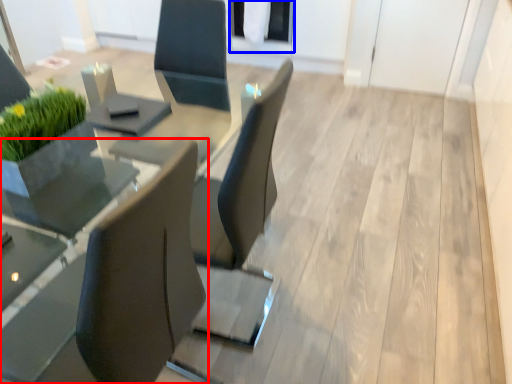
Question: Which object is closer to the camera taking this photo, chair (highlighted by a red box) or glass door (highlighted by a blue box)?

Choices:
 (A) chair
 (B) glass door

Answer: (A)